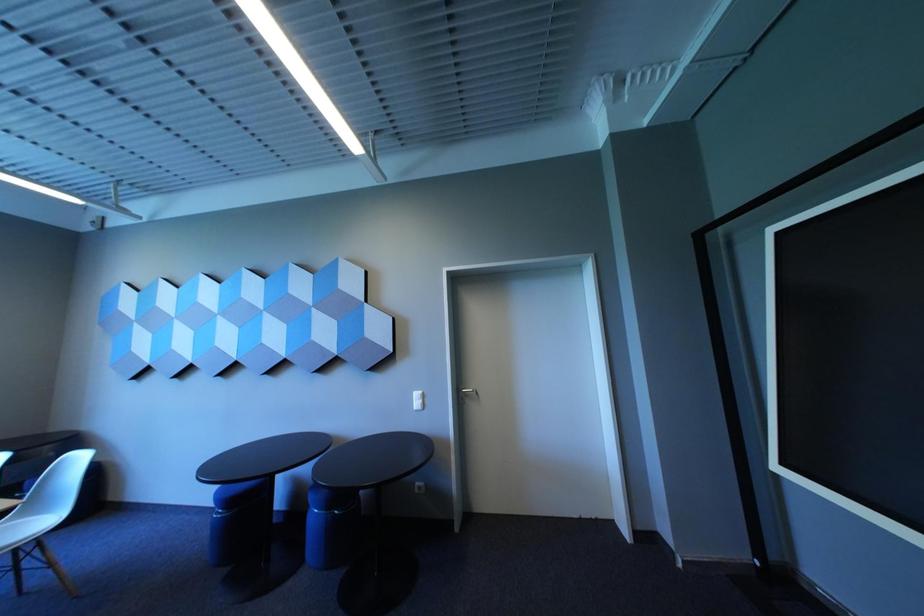
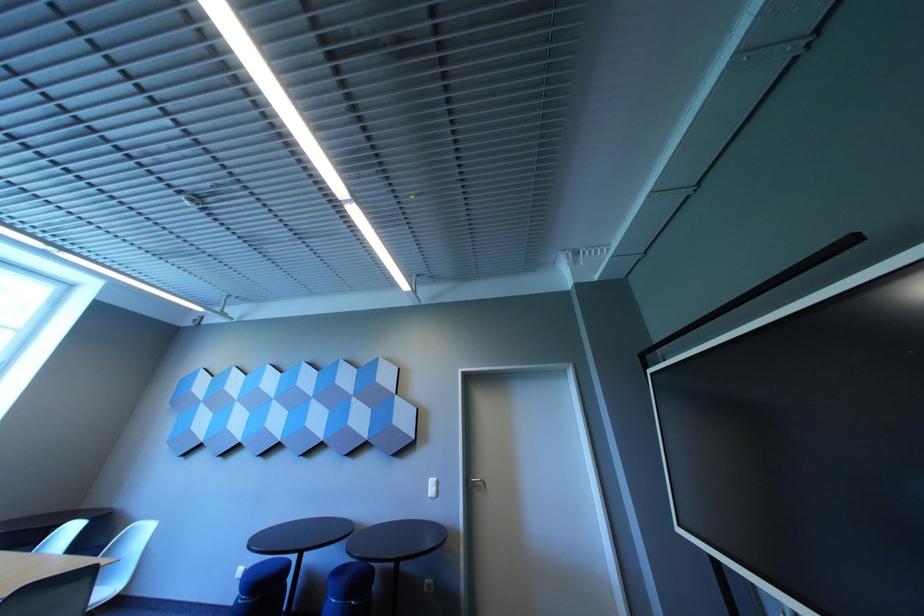
Question: In a continuous first-person perspective shot, in which direction is the camera moving?

Choices:
 (A) Left
 (B) Right
 (C) Forward
 (D) Backward

Answer: (D)